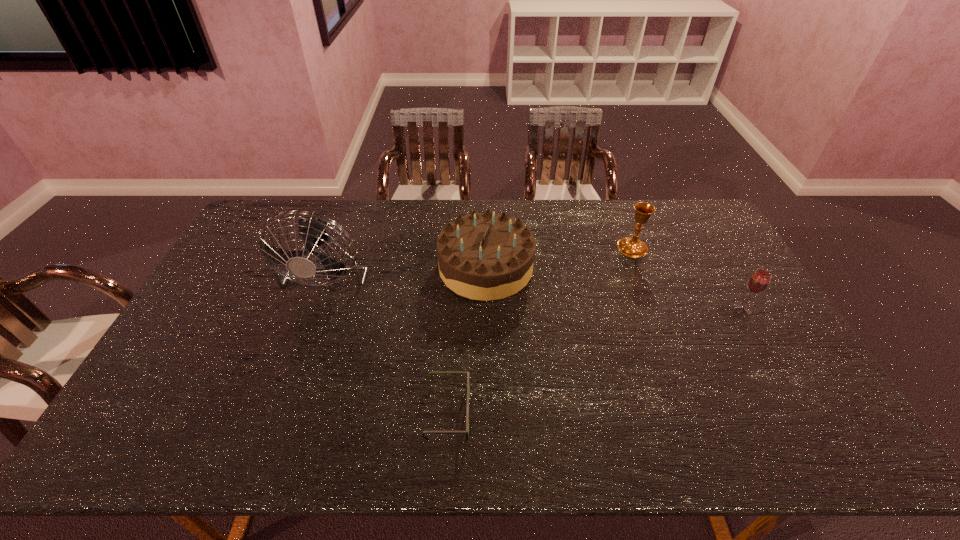
Locate an element on the screen. vacant point located between the wineglass and the tallest object is located at coordinates (537, 287).

Locate an element on the screen. free spot between the wineglass and the birthday cake is located at coordinates (614, 288).

Identify the location of vacant area that lies between the birthday cake and the wineglass. (614, 288).

Find the location of a particular element. This screenshot has height=540, width=960. unoccupied position between the birthday cake and the nearest object is located at coordinates (467, 340).

You are a GUI agent. You are given a task and a screenshot of the screen. Output one action in this format:
    pyautogui.click(x=<x>, y=<y>)
    Task: Click on the object that is the third closest to the wineglass
    
    Given the screenshot: What is the action you would take?
    pyautogui.click(x=468, y=373)

Locate which object ranks in proximity to the wineglass. Please provide its 2D coordinates. Your answer should be formatted as a tuple, i.e. [(x, y)], where the tuple contains the x and y coordinates of a point satisfying the conditions above.

[(632, 247)]

The image size is (960, 540). I want to click on vacant space that satisfies the following two spatial constraints: 1. on the front-facing side of the birthday cake; 2. on the right side of the rightmost object, so click(487, 309).

Where is `vacant area that satisfies the following two spatial constraints: 1. on the front side of the wineglass; 2. on the left side of the fourth object from left to right`? The width and height of the screenshot is (960, 540). vacant area that satisfies the following two spatial constraints: 1. on the front side of the wineglass; 2. on the left side of the fourth object from left to right is located at coordinates (657, 309).

Locate an element on the screen. This screenshot has width=960, height=540. free location that satisfies the following two spatial constraints: 1. on the front side of the chalice; 2. on the lens of the spectacles is located at coordinates pos(696,412).

The image size is (960, 540). What are the coordinates of `vacant region that satisfies the following two spatial constraints: 1. on the back side of the wineglass; 2. on the front-facing side of the birthday cake` in the screenshot? It's located at (718, 267).